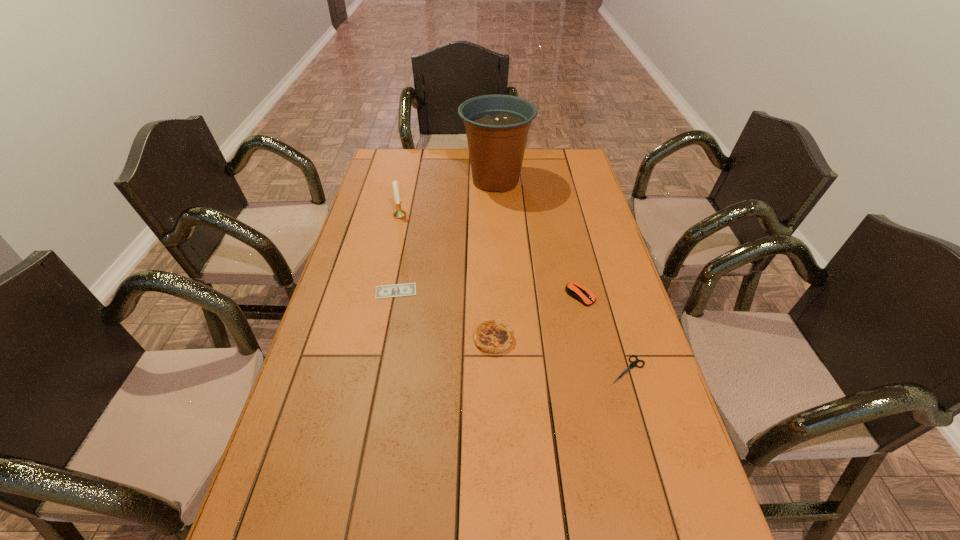
Image resolution: width=960 pixels, height=540 pixels. Find the location of `the farthest object`. the farthest object is located at coordinates (497, 126).

At what (x,y) coordinates should I click in order to perform the action: click on flowerpot. Please return your answer as a coordinate pair (x, y). Looking at the image, I should click on (497, 126).

Find the location of a particular element. the second farthest object is located at coordinates (399, 213).

The height and width of the screenshot is (540, 960). In order to click on candle holder in this screenshot , I will do `click(399, 213)`.

At what (x,y) coordinates should I click in order to perform the action: click on computer mouse. Please return your answer as a coordinate pair (x, y). This screenshot has height=540, width=960. Looking at the image, I should click on (576, 290).

Find the location of a particular element. The width and height of the screenshot is (960, 540). quiche is located at coordinates point(491,336).

This screenshot has width=960, height=540. I want to click on the nearest object, so click(x=633, y=364).

Locate an element on the screen. shears is located at coordinates point(633,364).

This screenshot has height=540, width=960. I want to click on money, so click(x=409, y=289).

Where is `free space located on the left of the tallest object`? free space located on the left of the tallest object is located at coordinates (431, 181).